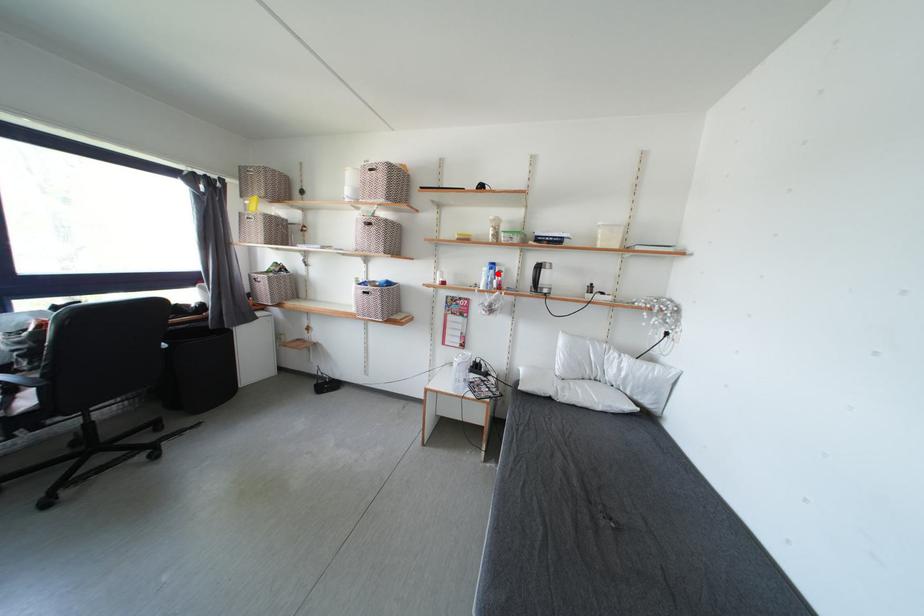
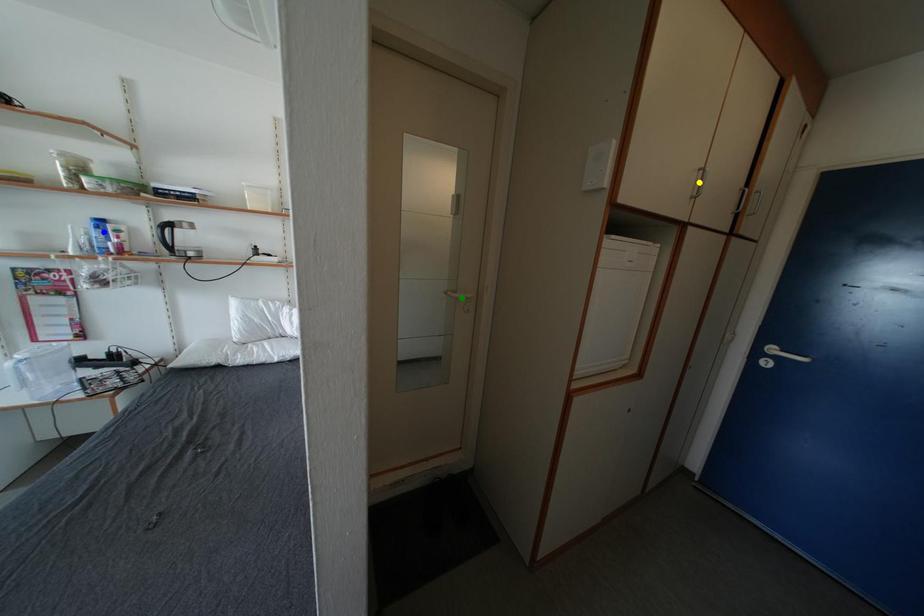
Question: I am providing you with two images of the same scene from different viewpoints. A red point is marked on the first image. You are given multiple points on the second image. Can you choose the point in image 2 that corresponds to the point in image 1?

Choices:
 (A) yellow point
 (B) blue point
 (C) green point

Answer: (B)